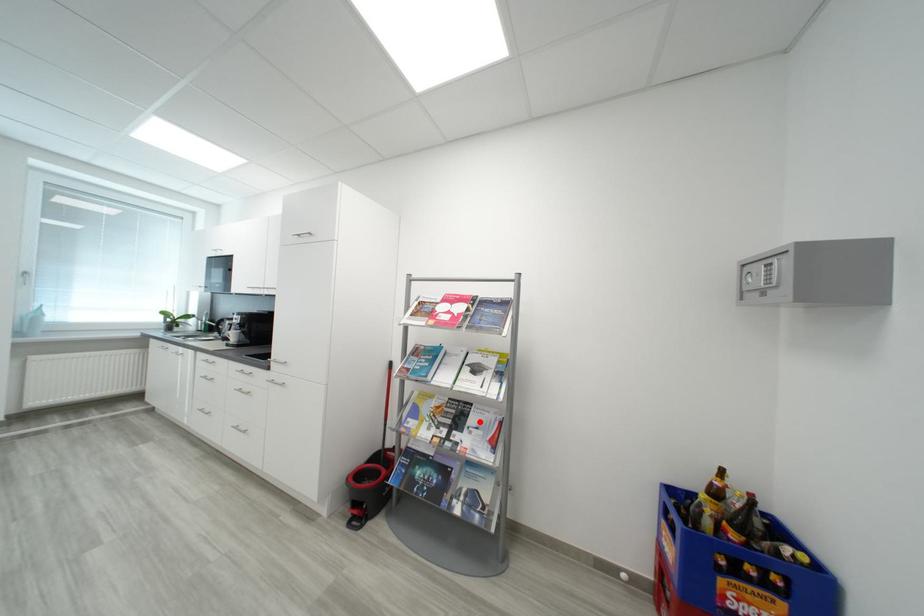
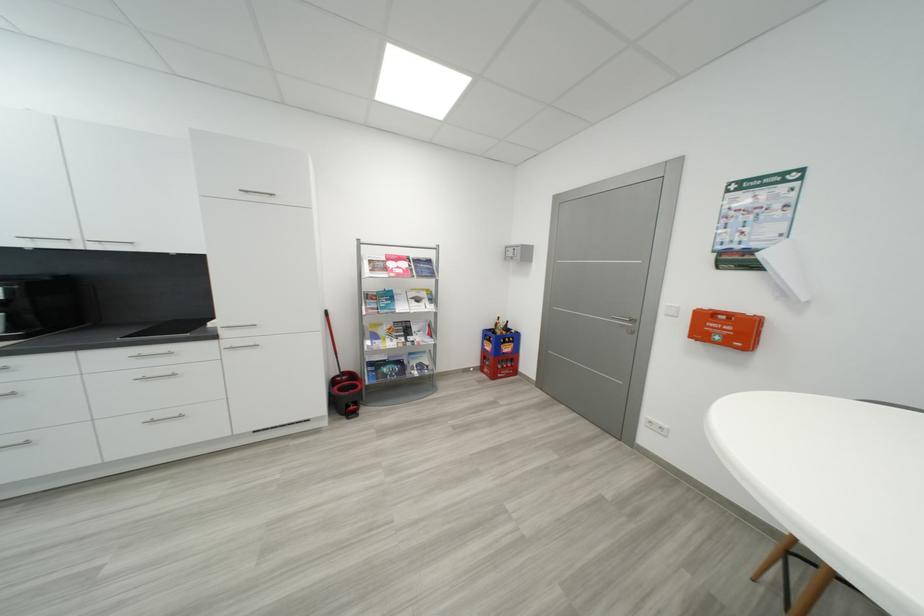
Find the pixel in the second image that matches the highlighted location in the first image.

(421, 330)